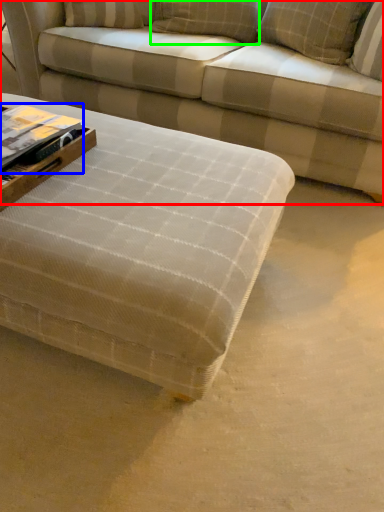
Question: Which object is the closest to the studio couch (highlighted by a red box)? Choose among these: book (highlighted by a blue box) or pillow (highlighted by a green box).

Choices:
 (A) book
 (B) pillow

Answer: (B)